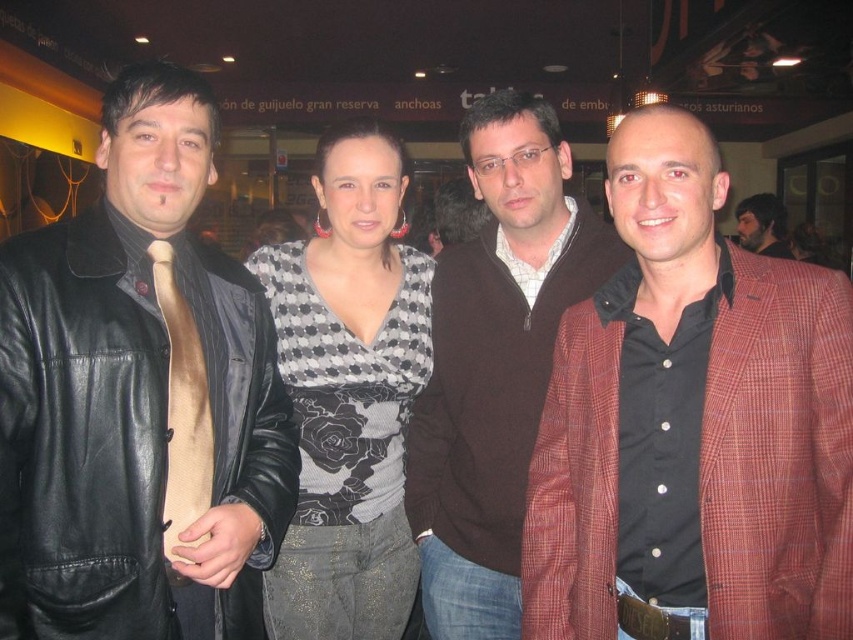
Question: Which object is closer to the camera taking this photo?

Choices:
 (A) brown zip-up sweater at center
 (B) beige silk tie at left
 (C) plaid wool blazer at right
 (D) brown leather jacket at center

Answer: (C)

Question: Does black leather jacket at left appear on the right side of brown leather jacket at center?

Choices:
 (A) yes
 (B) no

Answer: (B)

Question: Where is plaid wool blazer at right located in relation to checkered fabric top at center in the image?

Choices:
 (A) left
 (B) right

Answer: (B)

Question: Estimate the real-world distances between objects in this image. Which object is closer to the brown zip-up sweater at center?

Choices:
 (A) black leather jacket at left
 (B) plaid wool blazer at right

Answer: (B)

Question: Can you confirm if plaid wool blazer at right is thinner than brown zip-up sweater at center?

Choices:
 (A) yes
 (B) no

Answer: (A)

Question: Which of these objects is positioned closest to the black leather jacket at left?

Choices:
 (A) plaid wool blazer at right
 (B) brown zip-up sweater at center

Answer: (A)